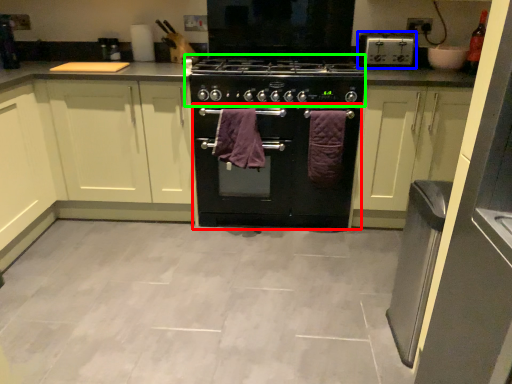
Question: Which is nearer to the oven (highlighted by a red box)? home appliance (highlighted by a blue box) or gas stove (highlighted by a green box).

Choices:
 (A) home appliance
 (B) gas stove

Answer: (B)